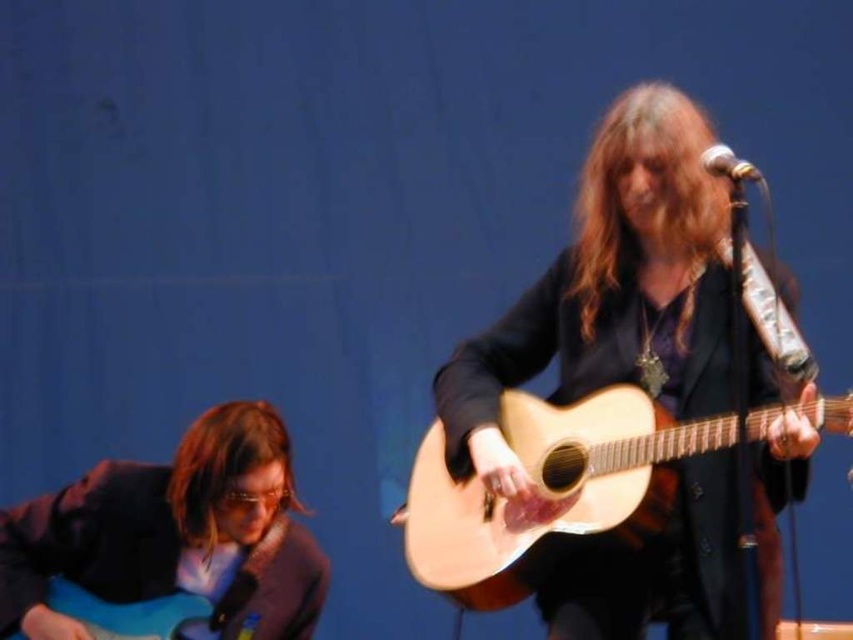
You are a photographer setting up for a live music session. You need to position a spotlight so that it illuminates both the natural wood guitar at center and the natural wood acoustic guitar at center without overlapping the beams. Given their positions, which guitar should the first spotlight target to the left and which to the right?

The natural wood acoustic guitar at center should be lit to the left, and the natural wood guitar at center to the right since the natural wood guitar at center is positioned to the right of the natural wood acoustic guitar at center.

You are standing in the audience and want to take a photo of the musician playing the acoustic guitar. The camera you are using has a focal length of 50mm and a sensor size of 24mm x 36mm. The point at coordinate point (225, 429) is the location of the microphone stand. Is the microphone stand within the camera sensor area when focused on the acoustic guitarist?

The distance between the point (225, 429) and the viewer is 9.20 feet. Since the microphone stand is at that point, it is within the camera sensor area when focused on the acoustic guitarist as it is close enough and within the frame.

You are a photographer at the back of the stage. You want to capture a closeup shot of the brown matte hair at lower left and the blue glossy electric guitar at lower left. Since you can only focus on one subject at a time, which one should you choose to ensure the other is still in focus?

Since the brown matte hair at lower left is closer to the viewer than the blue glossy electric guitar at lower left, focusing on the brown matte hair at lower left will keep the blue glossy electric guitar at lower left in focus due to depth of field principles. Alternatively, focusing on the blue glossy electric guitar at lower left may leave the brown matte hair at lower left slightly out of focus.